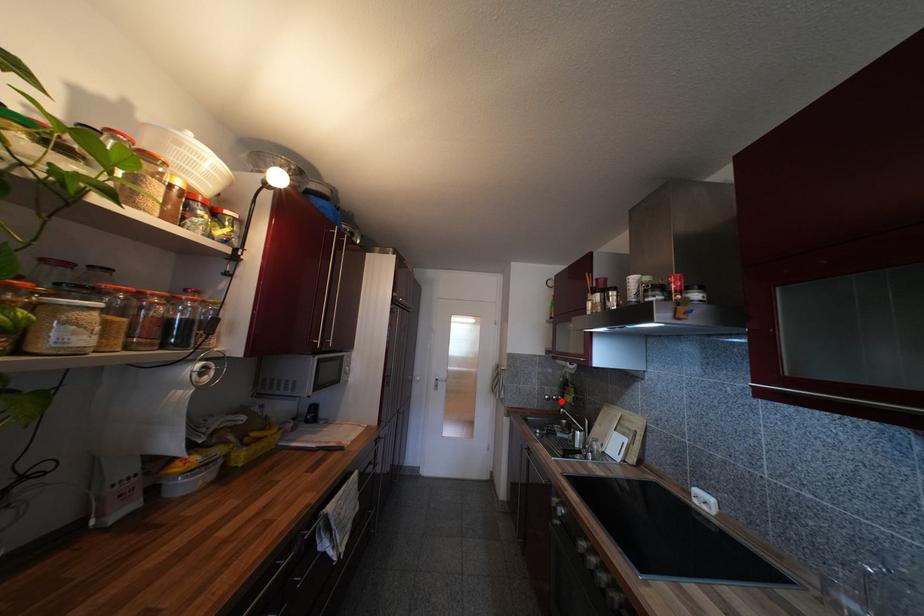
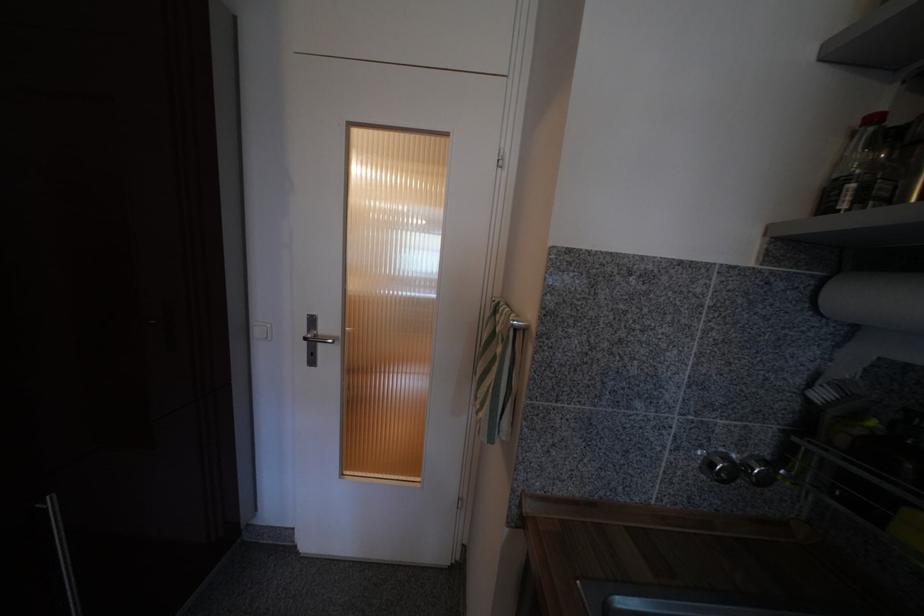
Question: I am providing you with two images of the same scene from different viewpoints. Image1 has a red point marked. In image2, the corresponding 3D location appears at what relative position? Reply with the corresponding letter.

Choices:
 (A) Closer
 (B) Farther

Answer: (A)